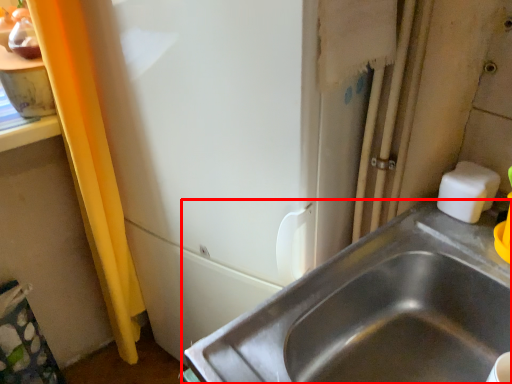
Question: From the image's perspective, where is sink (annotated by the red box) located in relation to soap in the image?

Choices:
 (A) above
 (B) below

Answer: (B)